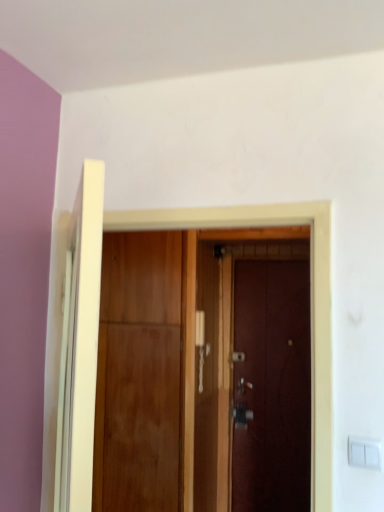
Question: From a real-world perspective, is wooden door at center, placed as the 1th door when sorted from front to back, beneath wooden door at center, the 2th door when ordered from front to back?

Choices:
 (A) yes
 (B) no

Answer: (B)

Question: Is wooden door at center, placed as the 1th door when sorted from front to back, in front of wooden door at center, the 2th door positioned from the back?

Choices:
 (A) no
 (B) yes

Answer: (B)

Question: Can you see wooden door at center, which ranks as the third door in back-to-front order, touching wooden door at center, the 2th door positioned from the back?

Choices:
 (A) yes
 (B) no

Answer: (B)

Question: Is wooden door at center, which ranks as the third door in back-to-front order, thinner than wooden door at center, the 2th door positioned from the back?

Choices:
 (A) no
 (B) yes

Answer: (B)

Question: Is wooden door at center, which ranks as the third door in back-to-front order, located outside wooden door at center, the 2th door positioned from the back?

Choices:
 (A) no
 (B) yes

Answer: (B)

Question: From the image's perspective, relative to wooden door at center, the 2th door when ordered from front to back, is dark wood door at center, which is the 1th door from back to front, above or below?

Choices:
 (A) above
 (B) below

Answer: (B)

Question: In the image, is dark wood door at center, placed as the third door when sorted from front to back, positioned in front of or behind wooden door at center, the 2th door when ordered from front to back?

Choices:
 (A) front
 (B) behind

Answer: (B)

Question: From a real-world perspective, is dark wood door at center, which is the 1th door from back to front, positioned above or below wooden door at center, the 2th door positioned from the back?

Choices:
 (A) above
 (B) below

Answer: (B)

Question: Would you say dark wood door at center, placed as the third door when sorted from front to back, is to the left or to the right of wooden door at center, the 2th door positioned from the back, in the picture?

Choices:
 (A) left
 (B) right

Answer: (B)

Question: From a real-world perspective, relative to dark wood door at center, which is the 1th door from back to front, is wooden door at center, the 2th door positioned from the back, vertically above or below?

Choices:
 (A) below
 (B) above

Answer: (B)

Question: Based on their positions, is wooden door at center, the 2th door positioned from the back, located to the left or right of dark wood door at center, placed as the third door when sorted from front to back?

Choices:
 (A) left
 (B) right

Answer: (A)

Question: In terms of height, does wooden door at center, the 2th door positioned from the back, look taller or shorter compared to dark wood door at center, which is the 1th door from back to front?

Choices:
 (A) tall
 (B) short

Answer: (A)

Question: In terms of width, does wooden door at center, the 2th door when ordered from front to back, look wider or thinner when compared to dark wood door at center, which is the 1th door from back to front?

Choices:
 (A) thin
 (B) wide

Answer: (B)

Question: In the image, is wooden door at center, the 2th door positioned from the back, positioned in front of or behind wooden door at center, placed as the 1th door when sorted from front to back?

Choices:
 (A) front
 (B) behind

Answer: (B)

Question: From their relative heights in the image, would you say wooden door at center, the 2th door positioned from the back, is taller or shorter than wooden door at center, which ranks as the third door in back-to-front order?

Choices:
 (A) tall
 (B) short

Answer: (A)